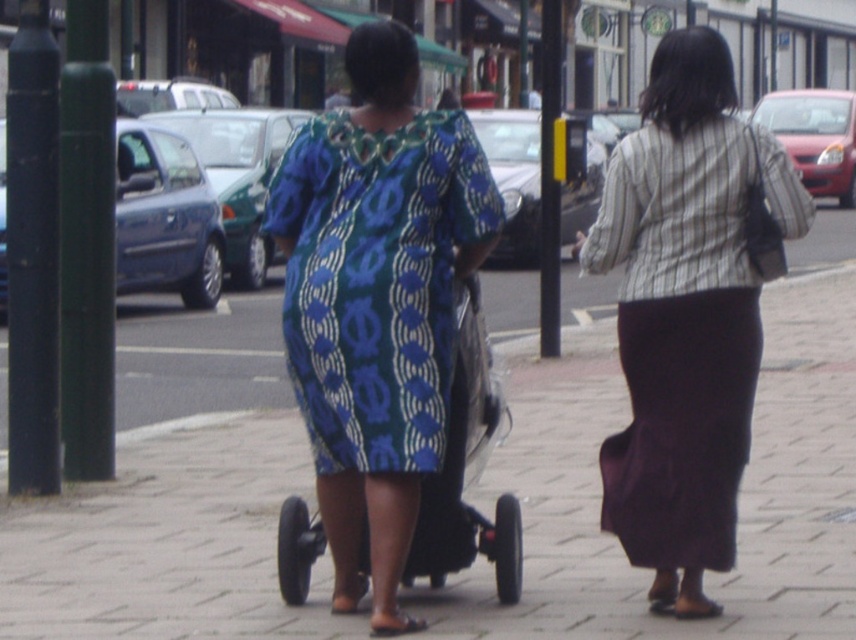
You are standing on the street and see two points marked in the scene. Which point is closer to you, point (x=311, y=589) or point (x=628, y=180)?

Point (x=311, y=589) is closer to you because it is further to the viewer than point (x=628, y=180).

Looking at this image, you are a delivery person who needs to place a small package on the brick pavement at center. However, there is a blue printed fabric dress at center in the way. Can you place the package there without moving the dress?

The brick pavement at center is wider than the blue printed fabric dress at center, so there is enough space to place the package without moving the dress.

You are a delivery person trying to navigate through the street scene. You need to place a large package on the ground. Which object, the brick pavement at center or the black rubber stroller at center, is more suitable for placing the package?

The brick pavement at center is larger in size than the black rubber stroller at center, so the brick pavement at center is more suitable for placing the large package.